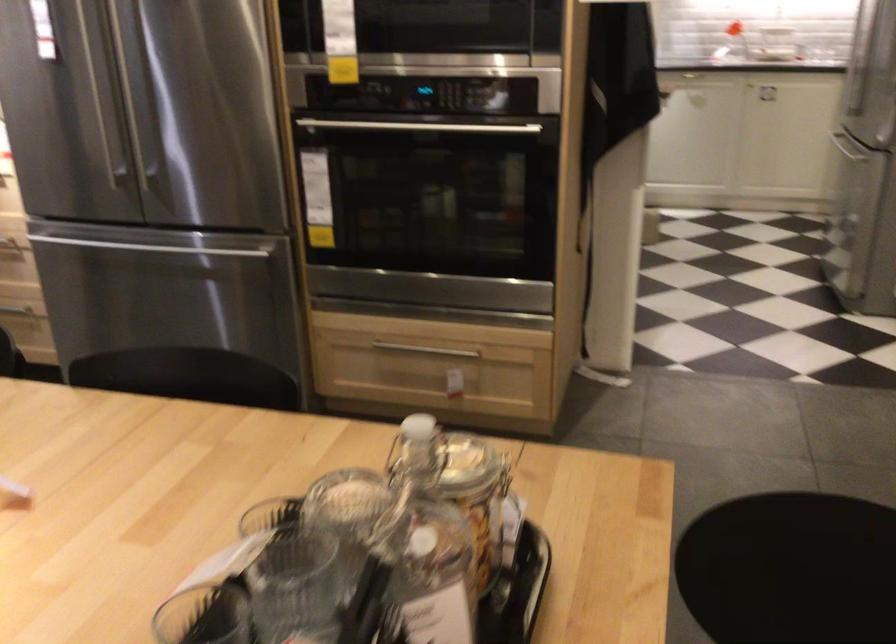
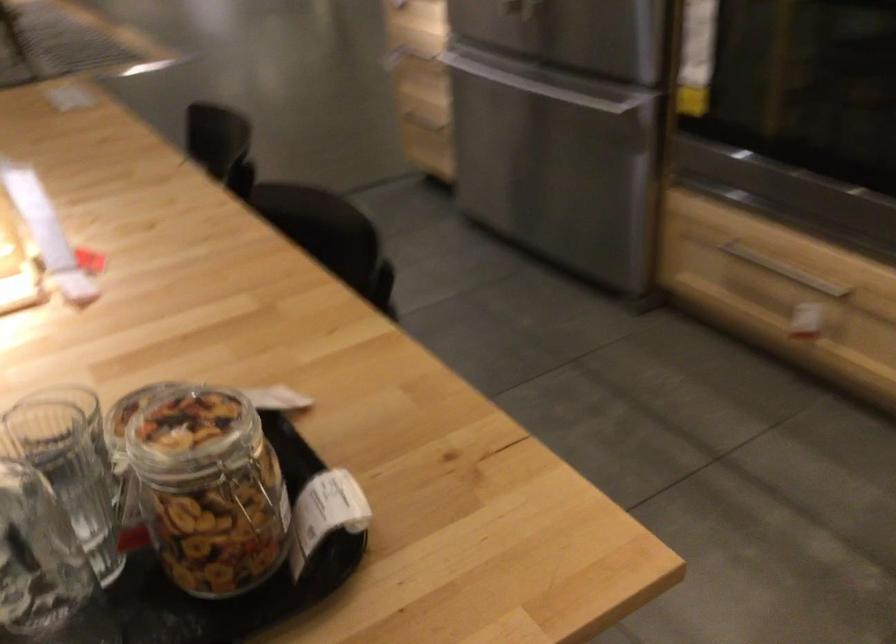
Find the pixel in the second image that matches (x=434, y=343) in the first image.

(784, 270)